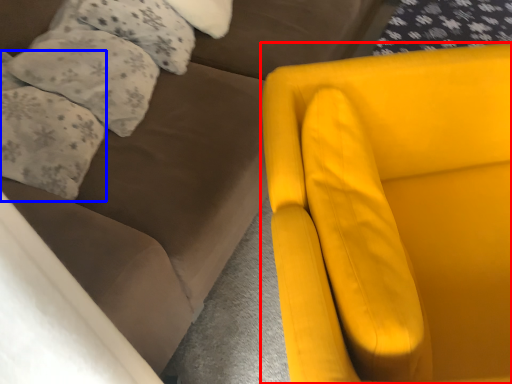
Question: Which object is further to the camera taking this photo, chair (highlighted by a red box) or pillow (highlighted by a blue box)?

Choices:
 (A) chair
 (B) pillow

Answer: (B)